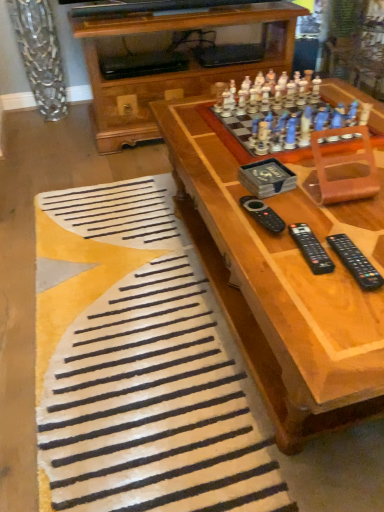
Locate an element on the screen. The height and width of the screenshot is (512, 384). vacant area to the left of wooden chess set at upper right is located at coordinates 191,129.